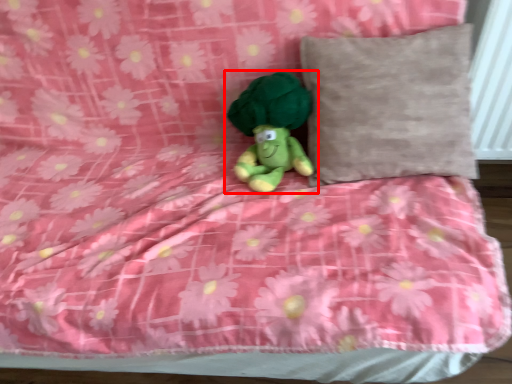
Question: From the image's perspective, where is toy (annotated by the red box) located relative to pillow?

Choices:
 (A) below
 (B) above

Answer: (A)